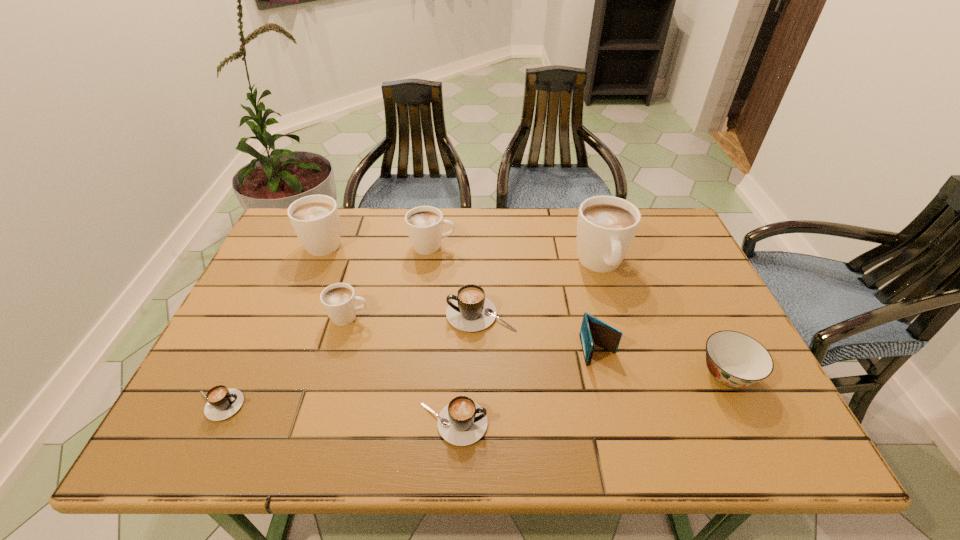
This screenshot has height=540, width=960. What are the coordinates of `free space located 0.400m with the handle on the side of the farthest black cappuccino` in the screenshot? It's located at pyautogui.click(x=292, y=314).

Locate an element on the screen. The image size is (960, 540). free location located with the handle on the side of the farthest black cappuccino is located at coordinates (307, 314).

Where is `free space located 0.100m with the handle on the side of the farthest black cappuccino`? free space located 0.100m with the handle on the side of the farthest black cappuccino is located at coordinates (408, 314).

The height and width of the screenshot is (540, 960). I want to click on vacant space located on the back of the rightmost object, so click(690, 300).

Where is `free space located 0.160m with the handle on the side of the sixth tallest cappuccino`? This screenshot has width=960, height=540. free space located 0.160m with the handle on the side of the sixth tallest cappuccino is located at coordinates (564, 423).

Where is `free point located with the handle on the side of the shortest cappuccino`? free point located with the handle on the side of the shortest cappuccino is located at coordinates (289, 406).

The image size is (960, 540). Find the location of `object that is at the right edge`. object that is at the right edge is located at coordinates (735, 359).

Image resolution: width=960 pixels, height=540 pixels. Identify the location of object located at the far left corner. (315, 219).

Find the location of a particular element. object present at the near left corner is located at coordinates (222, 403).

Locate an element on the screen. free space at the far edge is located at coordinates (389, 238).